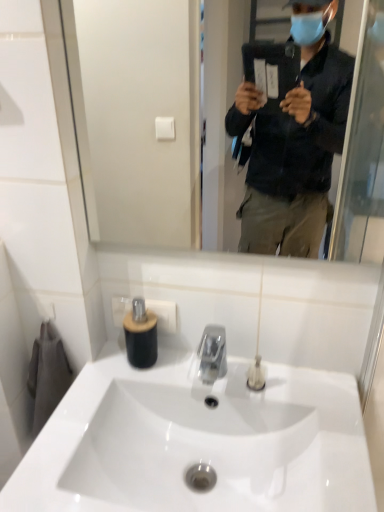
Question: In terms of size, does white glossy sink at center appear bigger or smaller than clear glass mirror at upper center?

Choices:
 (A) small
 (B) big

Answer: (B)

Question: From a real-world perspective, relative to clear glass mirror at upper center, is white glossy sink at center vertically above or below?

Choices:
 (A) above
 (B) below

Answer: (B)

Question: Estimate the real-world distances between objects in this image. Which object is farther from the clear plastic tube at center, which ranks as the 2th toiletry in left-to-right order?

Choices:
 (A) white glossy sink at center
 (B) black matte soap dispenser at center, which is counted as the 1th toiletry, starting from the left
 (C) clear glass mirror at upper center

Answer: (C)

Question: Considering the real-world distances, which object is closest to the clear plastic tube at center, the 1th toiletry viewed from the right?

Choices:
 (A) clear glass mirror at upper center
 (B) white glossy sink at center
 (C) black matte soap dispenser at center, which is counted as the 1th toiletry, starting from the left

Answer: (B)